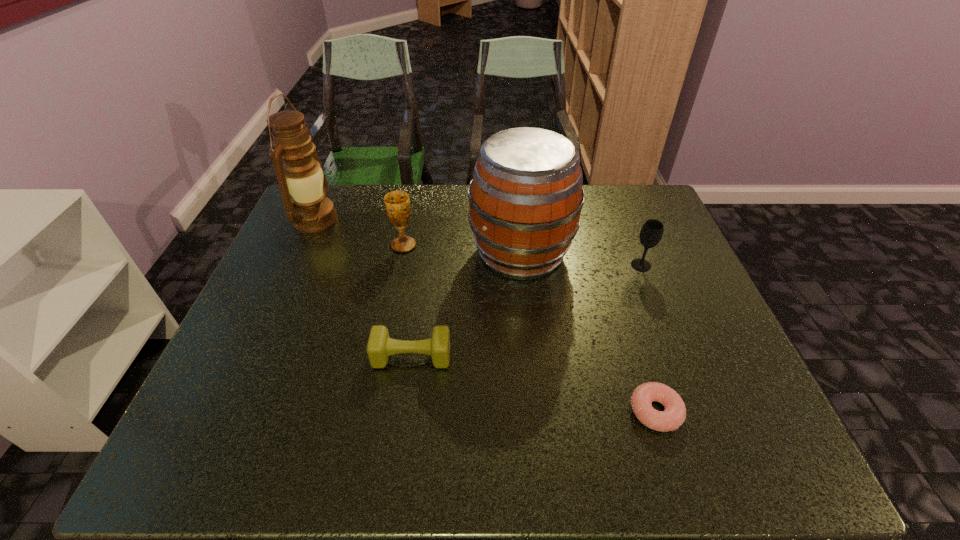
I want to click on object present at the left edge, so click(309, 210).

At what (x,y) coordinates should I click in order to perform the action: click on object at the right edge. Please return your answer as a coordinate pair (x, y). The width and height of the screenshot is (960, 540). Looking at the image, I should click on (652, 230).

The image size is (960, 540). I want to click on object that is at the far left corner, so click(x=309, y=210).

This screenshot has height=540, width=960. In order to click on free location at the near edge in this screenshot , I will do `click(612, 470)`.

Where is `vacant position at the left edge of the desktop`? The image size is (960, 540). vacant position at the left edge of the desktop is located at coordinates (322, 275).

You are a GUI agent. You are given a task and a screenshot of the screen. Output one action in this format:
    pyautogui.click(x=<x>, y=<y>)
    Task: Click on the vacant region at the right edge
    
    Given the screenshot: What is the action you would take?
    pyautogui.click(x=636, y=239)

Image resolution: width=960 pixels, height=540 pixels. Identify the location of vacant space at the far right corner of the desktop. (646, 212).

The height and width of the screenshot is (540, 960). What are the coordinates of `free space at the near right corner of the desktop` in the screenshot? It's located at (779, 449).

Locate an element on the screen. This screenshot has width=960, height=540. unoccupied area between the cider and the chalice is located at coordinates (463, 249).

Locate an element on the screen. The width and height of the screenshot is (960, 540). vacant point located between the fourth tallest object and the shortest object is located at coordinates (648, 338).